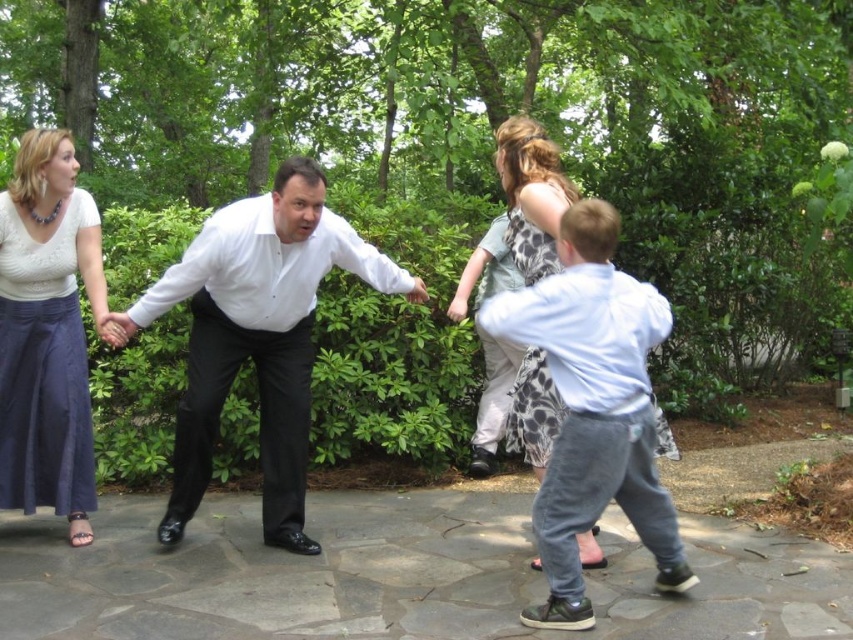
Question: Among these objects, which one is nearest to the camera?

Choices:
 (A) white lace top at upper left
 (B) white glossy shirt at center

Answer: (B)

Question: Can you confirm if white lace top at upper left is positioned above giraffe print dress at center?

Choices:
 (A) no
 (B) yes

Answer: (A)

Question: In this image, where is white lace top at upper left located relative to giraffe print dress at center?

Choices:
 (A) right
 (B) left

Answer: (B)

Question: Which object is farther from the camera taking this photo?

Choices:
 (A) light blue shirt at center
 (B) white shirt at center
 (C) giraffe print dress at center

Answer: (C)

Question: Which is nearer to the white shirt at center?

Choices:
 (A) white lace top at upper left
 (B) white glossy shirt at center
 (C) giraffe print dress at center

Answer: (B)

Question: Is light blue shirt at center smaller than white lace top at upper left?

Choices:
 (A) yes
 (B) no

Answer: (B)